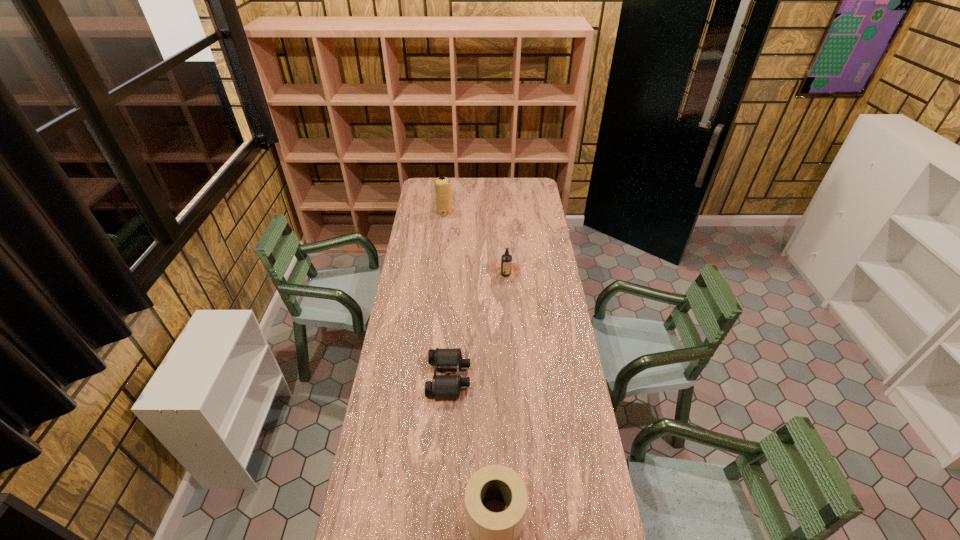
This screenshot has height=540, width=960. I want to click on aerosol can, so click(442, 184).

Locate an element on the screen. the farthest object is located at coordinates (442, 184).

At what (x,y) coordinates should I click in order to perform the action: click on root beer. Please return your answer as a coordinate pair (x, y). The height and width of the screenshot is (540, 960). Looking at the image, I should click on (506, 259).

Find the location of a particular element. The image size is (960, 540). the second tallest object is located at coordinates (506, 259).

You are a GUI agent. You are given a task and a screenshot of the screen. Output one action in this format:
    pyautogui.click(x=<x>, y=<y>)
    Task: Click on the binoculars
    
    Given the screenshot: What is the action you would take?
    pyautogui.click(x=442, y=386)

Find the location of `the second nearest object`. the second nearest object is located at coordinates (442, 386).

In order to click on free space located 0.140m on the back of the farthest object in this screenshot , I will do (x=445, y=197).

Identify the location of vacant position located 0.220m on the label of the second tallest object. (509, 316).

Find the location of a particular element. The width and height of the screenshot is (960, 540). vacant space situated through the eyepieces of the shortest object is located at coordinates (519, 377).

At what (x,y) coordinates should I click in order to perform the action: click on object present at the left edge. Please return your answer as a coordinate pair (x, y). Looking at the image, I should click on (442, 184).